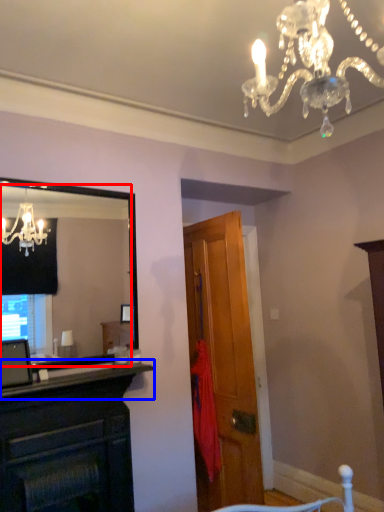
Question: Which point is closer to the camera, mirror (highlighted by a red box) or mantle (highlighted by a blue box)?

Choices:
 (A) mirror
 (B) mantle

Answer: (B)